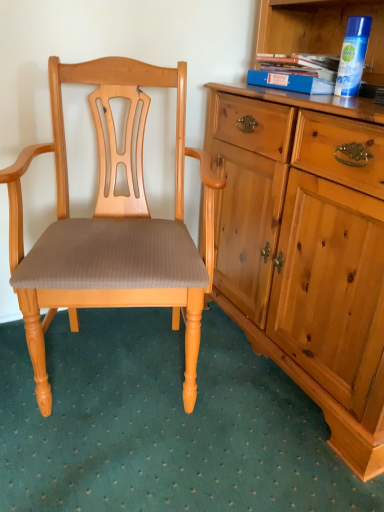
Question: Does blue hardcover book at upper right have a greater height compared to matte wood chair at center?

Choices:
 (A) no
 (B) yes

Answer: (A)

Question: From a real-world perspective, is blue hardcover book at upper right physically above matte wood chair at center?

Choices:
 (A) yes
 (B) no

Answer: (A)

Question: Is blue hardcover book at upper right facing away from matte wood chair at center?

Choices:
 (A) no
 (B) yes

Answer: (A)

Question: Does blue hardcover book at upper right appear on the left side of matte wood chair at center?

Choices:
 (A) no
 (B) yes

Answer: (A)

Question: Considering the relative sizes of blue hardcover book at upper right and matte wood chair at center in the image provided, is blue hardcover book at upper right shorter than matte wood chair at center?

Choices:
 (A) yes
 (B) no

Answer: (A)

Question: Is the depth of blue hardcover book at upper right greater than that of matte wood chair at center?

Choices:
 (A) no
 (B) yes

Answer: (B)

Question: Could you tell me if matte wood chair at center is facing blue hardcover book at upper right?

Choices:
 (A) yes
 (B) no

Answer: (B)

Question: Does matte wood chair at center come in front of blue hardcover book at upper right?

Choices:
 (A) no
 (B) yes

Answer: (B)

Question: Can you confirm if matte wood chair at center is bigger than blue hardcover book at upper right?

Choices:
 (A) no
 (B) yes

Answer: (B)

Question: From a real-world perspective, is matte wood chair at center positioned over blue hardcover book at upper right based on gravity?

Choices:
 (A) no
 (B) yes

Answer: (A)

Question: Is matte wood chair at center wider than blue hardcover book at upper right?

Choices:
 (A) no
 (B) yes

Answer: (B)

Question: Is matte wood chair at center at the right side of blue hardcover book at upper right?

Choices:
 (A) no
 (B) yes

Answer: (A)

Question: From the image's perspective, is blue hardcover book at upper right located above or below matte wood chair at center?

Choices:
 (A) below
 (B) above

Answer: (B)